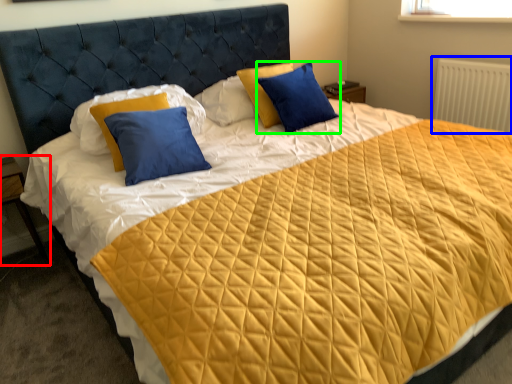
Question: Which object is the closest to the nightstand (highlighted by a red box)? Choose among these: radiator (highlighted by a blue box) or pillow (highlighted by a green box).

Choices:
 (A) radiator
 (B) pillow

Answer: (B)